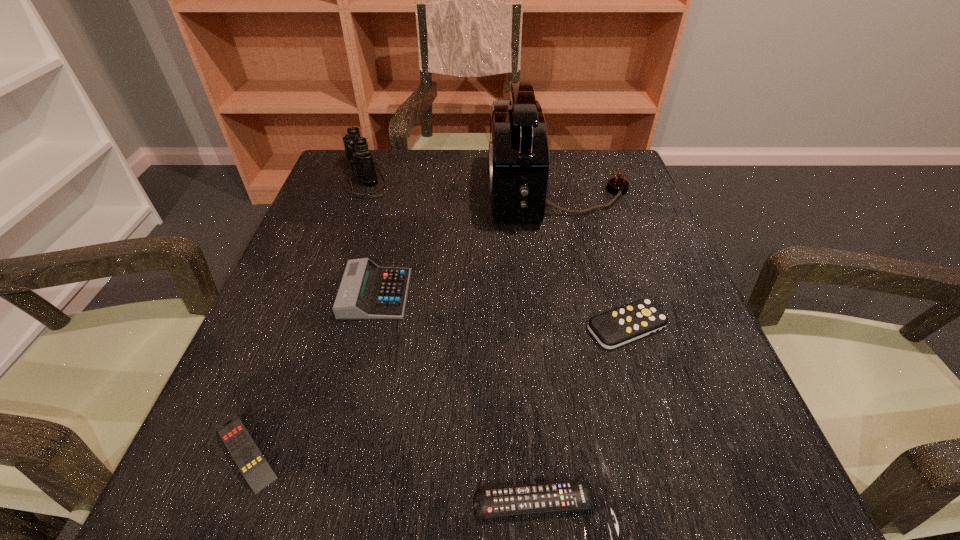
Locate an element on the screen. the tallest object is located at coordinates (519, 157).

Identify the location of the fifth shortest object. (356, 147).

Where is `the third tallest object`? The width and height of the screenshot is (960, 540). the third tallest object is located at coordinates (367, 291).

Where is `the farthest remote control`? This screenshot has height=540, width=960. the farthest remote control is located at coordinates (611, 329).

This screenshot has width=960, height=540. I want to click on the third shortest object, so click(x=611, y=329).

Locate an element on the screen. the leftmost remote control is located at coordinates (246, 454).

Find the location of a particular element. the second remote control from right to left is located at coordinates (491, 502).

Where is `vacant space located on the front-facing side of the radio receiver`? This screenshot has width=960, height=540. vacant space located on the front-facing side of the radio receiver is located at coordinates (388, 192).

At what (x,y) coordinates should I click in order to perform the action: click on free spot located 0.370m on the front-facing side of the radio receiver. Please return your answer as a coordinate pair (x, y). The image size is (960, 540). Looking at the image, I should click on (334, 192).

Where is `free space located on the front-facing side of the radio receiver`? The width and height of the screenshot is (960, 540). free space located on the front-facing side of the radio receiver is located at coordinates (409, 192).